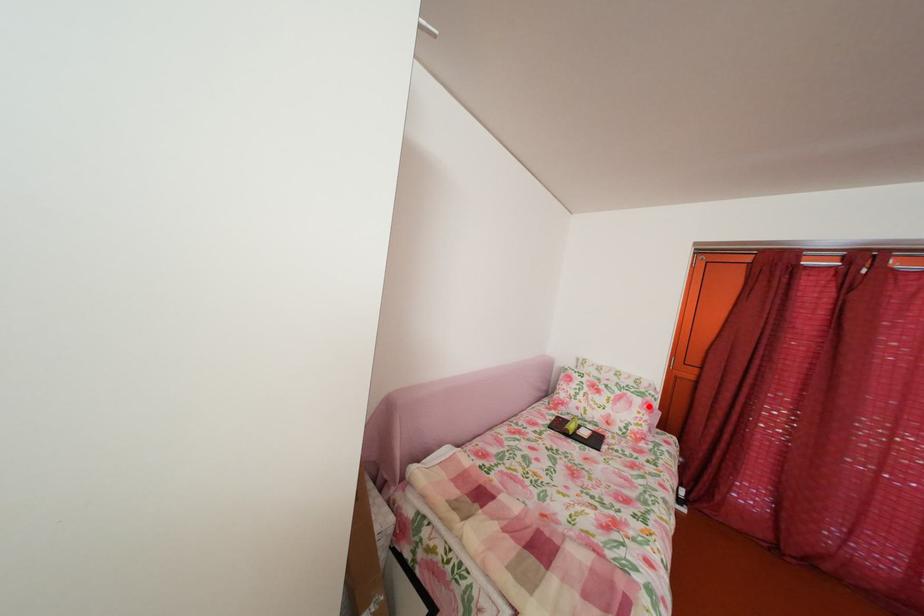
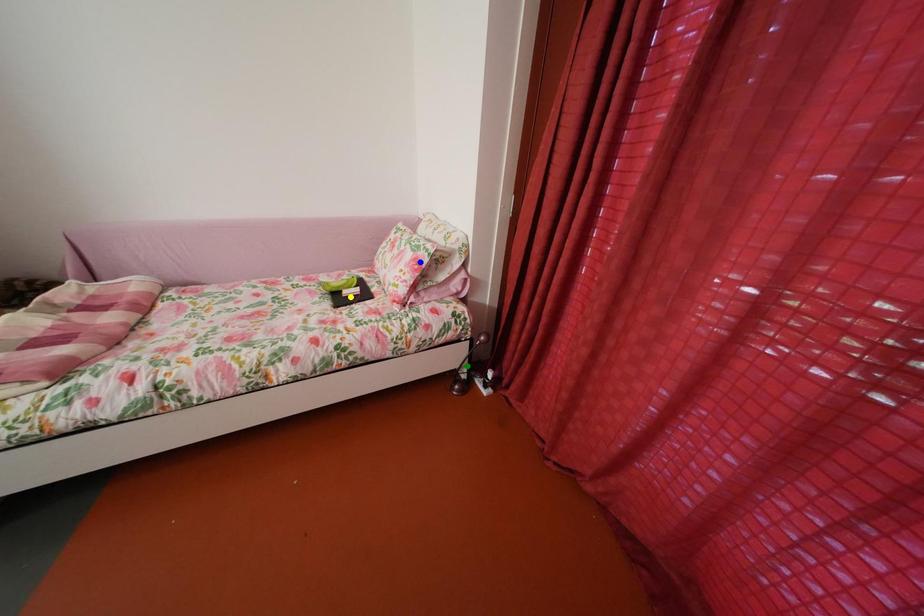
Question: I am providing you with two images of the same scene from different viewpoints. A red point is marked on the first image. You are given multiple points on the second image. In image 2, which mark is for the same physical point as the one in image 1?

Choices:
 (A) yellow point
 (B) green point
 (C) blue point

Answer: (C)